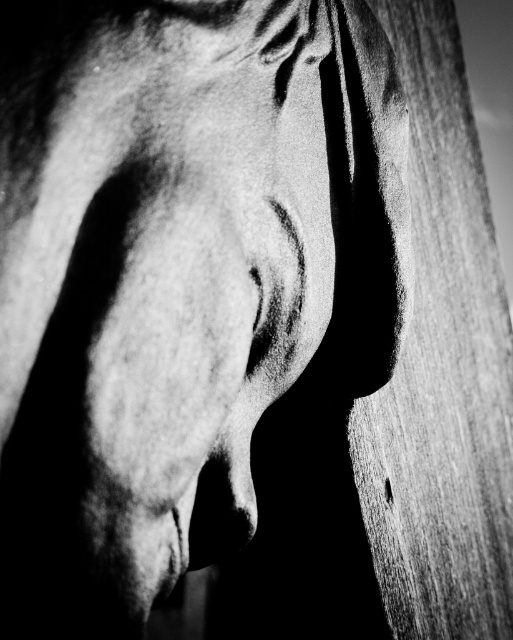
Question: Which point is farther from the camera taking this photo?

Choices:
 (A) (464, 632)
 (B) (249, 483)

Answer: (A)

Question: Can you confirm if wooden plank at right is bigger than smooth gray nose at center?

Choices:
 (A) yes
 (B) no

Answer: (A)

Question: Does wooden plank at right come in front of smooth gray nose at center?

Choices:
 (A) no
 (B) yes

Answer: (A)

Question: Can you confirm if wooden plank at right is positioned to the left of smooth gray nose at center?

Choices:
 (A) no
 (B) yes

Answer: (A)